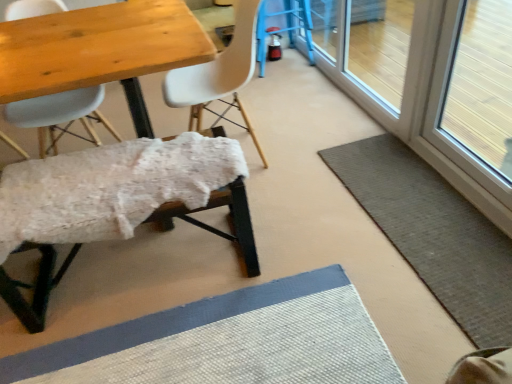
Question: Considering the positions of white fluffy bench at lower left, placed as the 2th chair when sorted from right to left, and blue plastic bar stool at upper right in the image, is white fluffy bench at lower left, placed as the 2th chair when sorted from right to left, bigger or smaller than blue plastic bar stool at upper right?

Choices:
 (A) small
 (B) big

Answer: (B)

Question: In the image, is white fluffy bench at lower left, the second chair when ordered from left to right, positioned in front of or behind blue plastic bar stool at upper right?

Choices:
 (A) front
 (B) behind

Answer: (A)

Question: Which object is the closest to the white matte chair at center, which is the first chair from right to left?

Choices:
 (A) transparent glass screen door at upper right
 (B) transparent glass window screen at right
 (C) blue plastic bar stool at upper right
 (D) white fluffy bench at lower left, the second chair when ordered from left to right
 (E) gray woven bath mat at lower right

Answer: (D)

Question: Estimate the real-world distances between objects in this image. Which object is closer to the white matte chair at center, which is the first chair from right to left?

Choices:
 (A) white fluffy bench at lower left, the second chair when ordered from left to right
 (B) matte white chair at upper left, marked as the 1th chair in a left-to-right arrangement
 (C) gray woven bath mat at lower right
 (D) transparent glass screen door at upper right
 (E) blue plastic bar stool at upper right

Answer: (A)